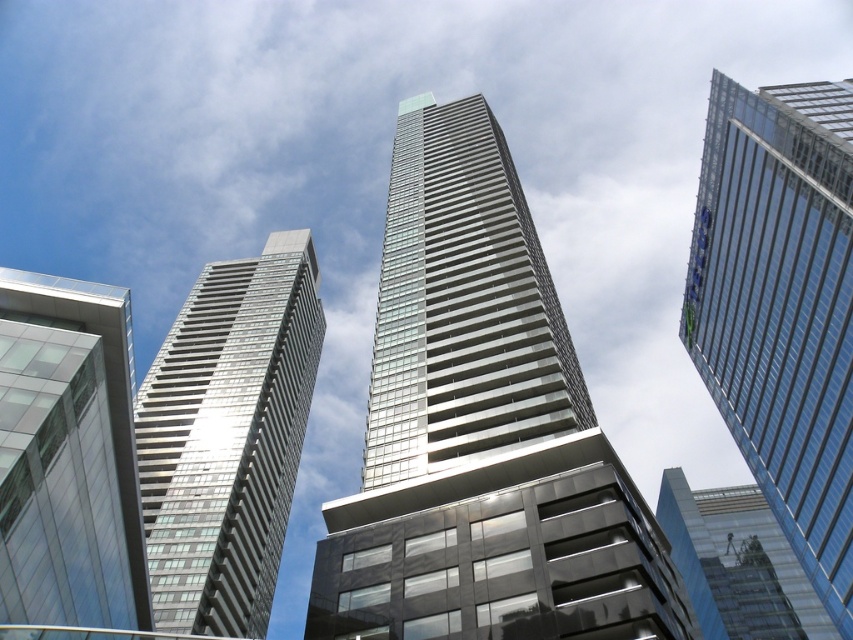
Can you confirm if silver glass skyscraper at left is smaller than transparent glass skyscraper at upper right?

Actually, silver glass skyscraper at left might be larger than transparent glass skyscraper at upper right.

The image size is (853, 640). In order to click on silver glass skyscraper at left in this screenshot , I will do `click(227, 436)`.

The image size is (853, 640). Find the location of `silver glass skyscraper at left`. silver glass skyscraper at left is located at coordinates (227, 436).

Can you confirm if glassy silver skyscraper at center is bigger than clear glass skyscraper at upper right?

Correct, glassy silver skyscraper at center is larger in size than clear glass skyscraper at upper right.

The width and height of the screenshot is (853, 640). In order to click on glassy silver skyscraper at center in this screenshot , I will do `click(480, 429)`.

Consider the image. Who is more forward, [544,573] or [769,348]?

Positioned in front is point [544,573].

I want to click on glassy silver skyscraper at center, so click(480, 429).

Which of these two, clear glass skyscraper at upper right or transparent glass building at lower left, stands taller?

Standing taller between the two is clear glass skyscraper at upper right.

Which is more to the right, clear glass skyscraper at upper right or transparent glass building at lower left?

Positioned to the right is clear glass skyscraper at upper right.

Image resolution: width=853 pixels, height=640 pixels. In order to click on clear glass skyscraper at upper right in this screenshot , I will do `click(781, 307)`.